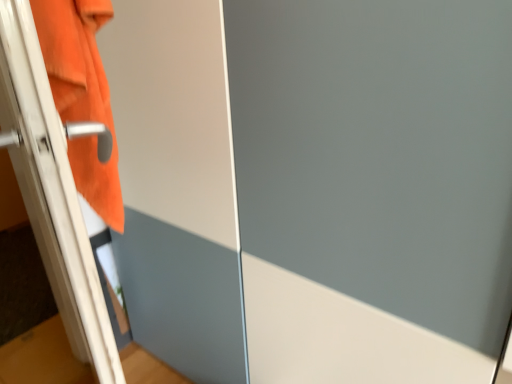
Question: Is orange fabric towel at left taller or shorter than white glossy screen door at left?

Choices:
 (A) tall
 (B) short

Answer: (B)

Question: In the image, is orange fabric towel at left on the left side or the right side of white glossy screen door at left?

Choices:
 (A) left
 (B) right

Answer: (B)

Question: Considering the positions of orange fabric towel at left and white glossy screen door at left in the image, is orange fabric towel at left wider or thinner than white glossy screen door at left?

Choices:
 (A) thin
 (B) wide

Answer: (A)

Question: Is white glossy screen door at left inside or outside of orange fabric towel at left?

Choices:
 (A) inside
 (B) outside

Answer: (B)

Question: From their relative heights in the image, would you say white glossy screen door at left is taller or shorter than orange fabric towel at left?

Choices:
 (A) tall
 (B) short

Answer: (A)

Question: In the image, is white glossy screen door at left on the left side or the right side of orange fabric towel at left?

Choices:
 (A) left
 (B) right

Answer: (A)

Question: From the image's perspective, is white glossy screen door at left located above or below orange fabric towel at left?

Choices:
 (A) below
 (B) above

Answer: (A)